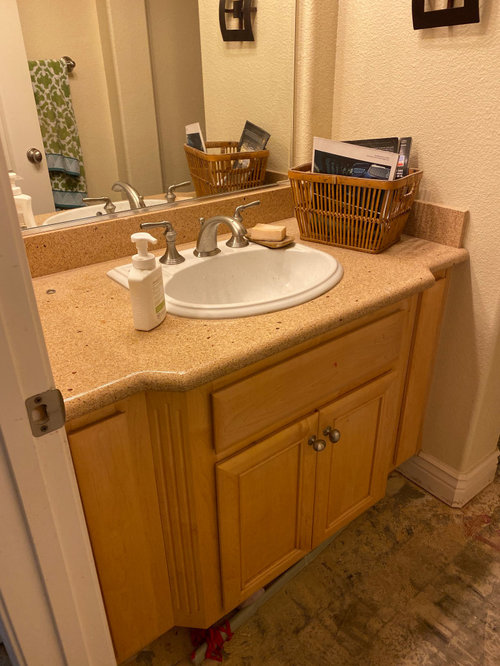
Where is `faucet`? faucet is located at coordinates (232, 222).